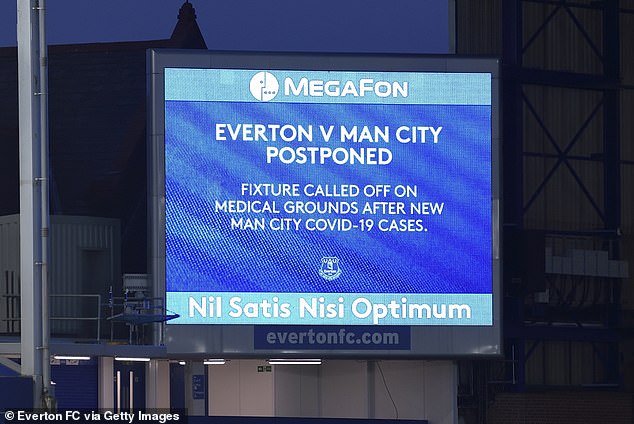
At what (x,y) coordinates should I click in order to perform the action: click on ridged white wall. Please return your answer as a coordinate pair (x, y). Looking at the image, I should click on (65, 254), (10, 241), (565, 195), (562, 363).